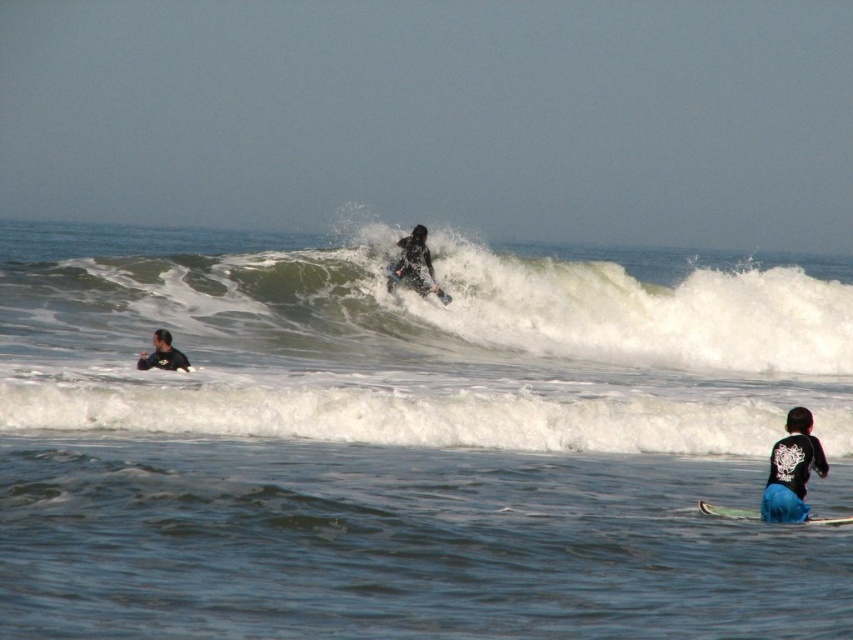
Question: Estimate the real-world distances between objects in this image. Which object is closer to the blue water at wave center?

Choices:
 (A) black wetsuit surfer at lower left
 (B) blue matte surfboard at lower right
 (C) smooth black surfboard at center
 (D) dark matte wetsuit at center

Answer: (C)

Question: Does black wetsuit surfer at lower left appear on the left side of blue matte surfboard at lower right?

Choices:
 (A) no
 (B) yes

Answer: (B)

Question: Is blue water at wave center to the left of blue matte surfboard at lower right from the viewer's perspective?

Choices:
 (A) yes
 (B) no

Answer: (A)

Question: Can you confirm if white frothy wave at center is bigger than black matte wetsuit at lower right?

Choices:
 (A) yes
 (B) no

Answer: (A)

Question: Which point is farther to the camera?

Choices:
 (A) (169, 340)
 (B) (260, 307)
 (C) (422, 227)
 (D) (428, 289)

Answer: (C)

Question: Which object appears farthest from the camera in this image?

Choices:
 (A) white frothy wave at center
 (B) blue matte surfboard at lower right
 (C) blue water at wave center

Answer: (A)